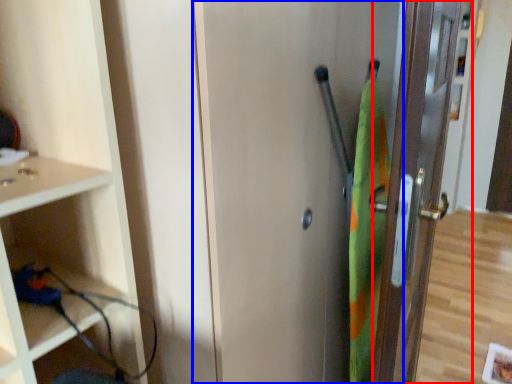
Question: Which object appears closest to the camera in this image, door (highlighted by a red box) or screen door (highlighted by a blue box)?

Choices:
 (A) door
 (B) screen door

Answer: (B)